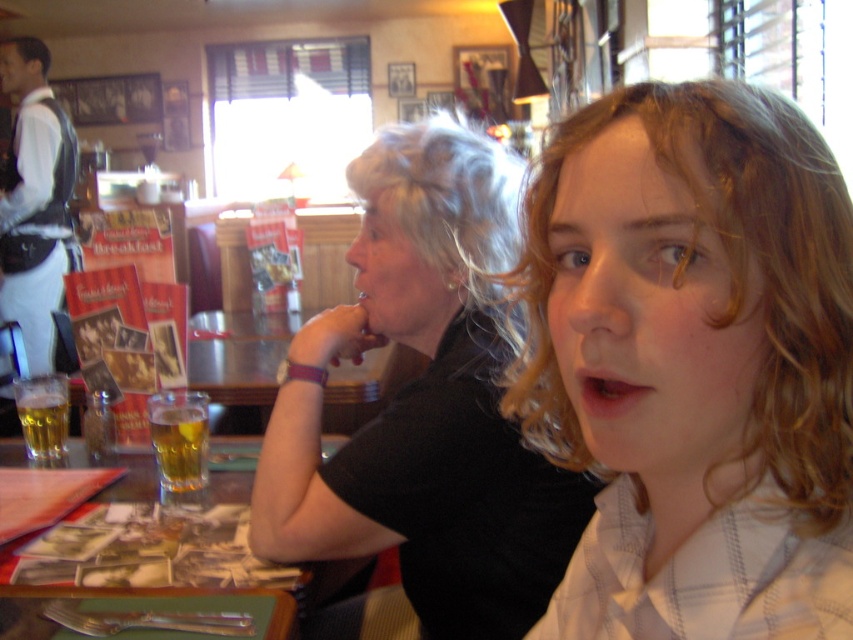
Question: Which object is the farthest from the wooden table at center?

Choices:
 (A) translucent glass beverage at table front
 (B) black matte shirt at center
 (C) translucent glass beer at lower left

Answer: (B)

Question: Does blonde hair at center appear on the left side of translucent glass beverage at table front?

Choices:
 (A) yes
 (B) no

Answer: (B)

Question: Is the position of black matte shirt at center more distant than that of translucent glass beverage at table front?

Choices:
 (A) no
 (B) yes

Answer: (A)

Question: Which point is closer to the camera taking this photo?

Choices:
 (A) (167, 420)
 (B) (701, 516)

Answer: (B)

Question: Which of the following is the farthest from the observer?

Choices:
 (A) (45, 410)
 (B) (316, 604)
 (C) (192, 464)
 (D) (618, 355)

Answer: (A)

Question: Is black matte shirt at center to the right of translucent glass beer at lower left from the viewer's perspective?

Choices:
 (A) yes
 (B) no

Answer: (A)